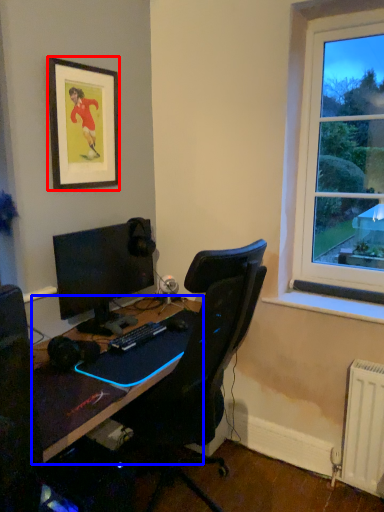
Question: Which of the following is the closest to the observer, picture frame (highlighted by a red box) or desk (highlighted by a blue box)?

Choices:
 (A) picture frame
 (B) desk

Answer: (B)